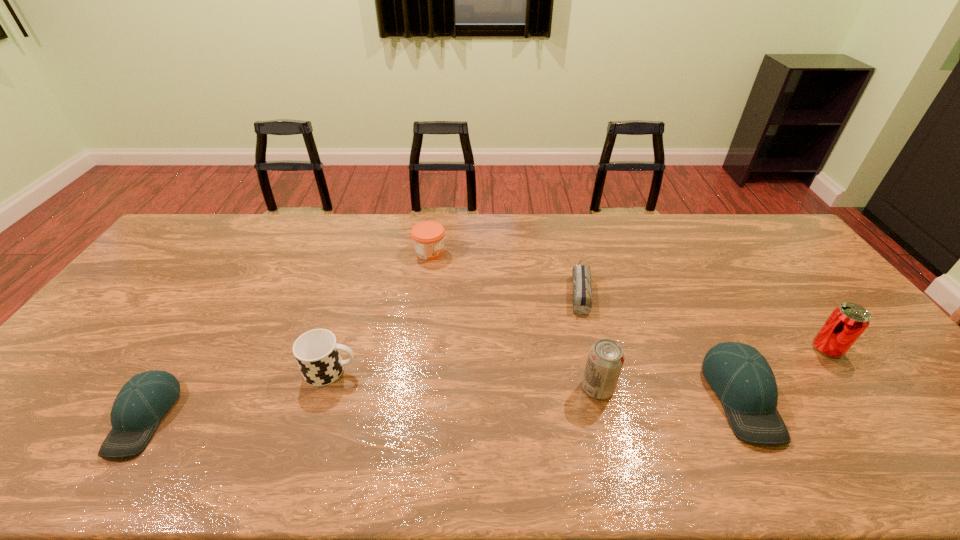
Where is `cup`? cup is located at coordinates (317, 353).

Locate an element on the screen. The height and width of the screenshot is (540, 960). the left soda can is located at coordinates (605, 360).

I want to click on blank area located 0.140m on the right of the left baseball cap, so click(x=228, y=417).

At what (x,y) coordinates should I click in order to perform the action: click on free space located 0.190m on the right of the right baseball cap. Please return your answer as a coordinate pair (x, y). The width and height of the screenshot is (960, 540). Looking at the image, I should click on (849, 397).

You are a GUI agent. You are given a task and a screenshot of the screen. Output one action in this format:
    pyautogui.click(x=<x>, y=<y>)
    Task: Click on the free point located 0.080m on the front label of the jam
    
    Given the screenshot: What is the action you would take?
    pyautogui.click(x=469, y=252)

At what (x,y) coordinates should I click in order to perform the action: click on free location located 0.240m on the left of the shortest object. Please return your answer as a coordinate pair (x, y). This screenshot has height=540, width=960. Looking at the image, I should click on (491, 291).

This screenshot has width=960, height=540. I want to click on free space located 0.270m on the left of the farther soda can, so pyautogui.click(x=714, y=349).

Locate an element on the screen. This screenshot has width=960, height=540. vacant space positioned on the side of the sixth object from right to left with the handle is located at coordinates (495, 370).

Where is `free space located on the right of the left soda can`? This screenshot has height=540, width=960. free space located on the right of the left soda can is located at coordinates (740, 388).

This screenshot has width=960, height=540. Find the location of `object positioned at the far edge`. object positioned at the far edge is located at coordinates (428, 236).